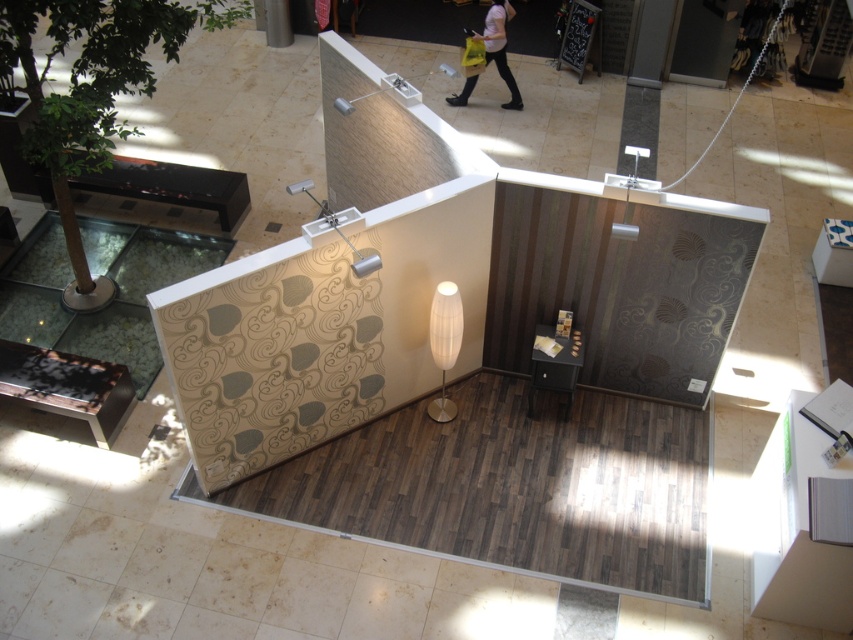
You are an interior designer assessing the layout of the showroom. You notice the wooden laminate floor at center and the matte pink shirt at upper center. Which object is positioned higher in the image?

The wooden laminate floor at center is higher than the matte pink shirt at upper center, so the wooden laminate floor at center is positioned higher in the image.